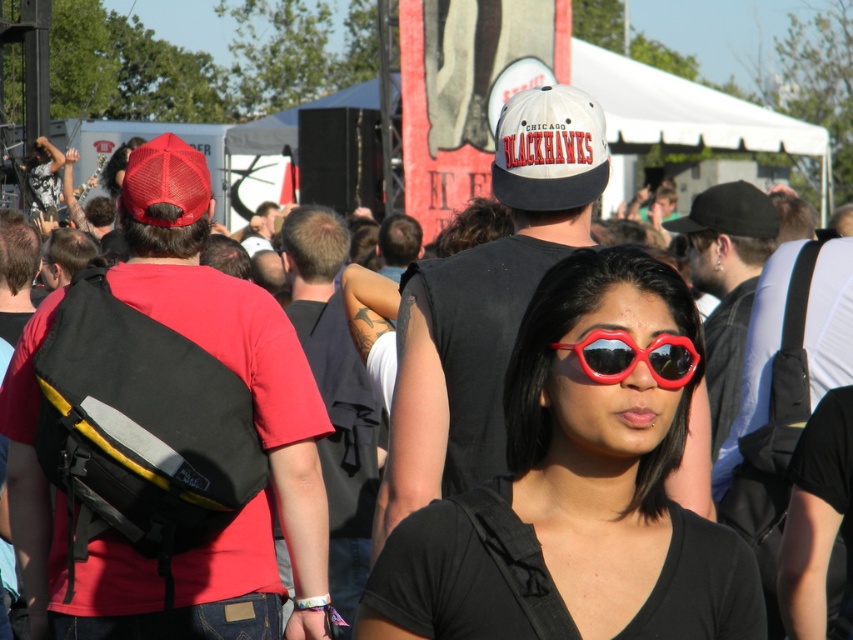
Question: Which point is farther from the camera taking this photo?

Choices:
 (A) (590, 360)
 (B) (618, 381)

Answer: (A)

Question: Is shiny plastic sunglasses at center bigger than red plastic sunglasses at center?

Choices:
 (A) no
 (B) yes

Answer: (B)

Question: Is shiny plastic sunglasses at center below red plastic sunglasses at center?

Choices:
 (A) yes
 (B) no

Answer: (A)

Question: In this image, where is shiny plastic sunglasses at center located relative to red plastic sunglasses at center?

Choices:
 (A) above
 (B) below

Answer: (B)